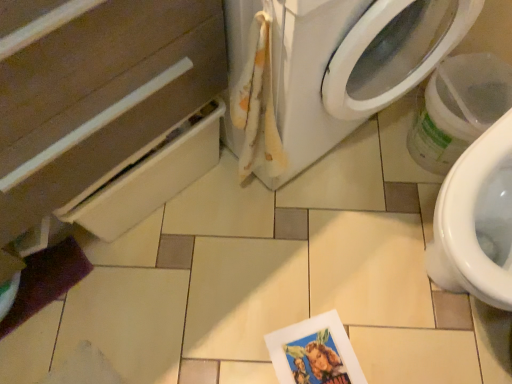
This screenshot has width=512, height=384. Identify the location of free space to the left of printed paper postcard at lower center. (244, 340).